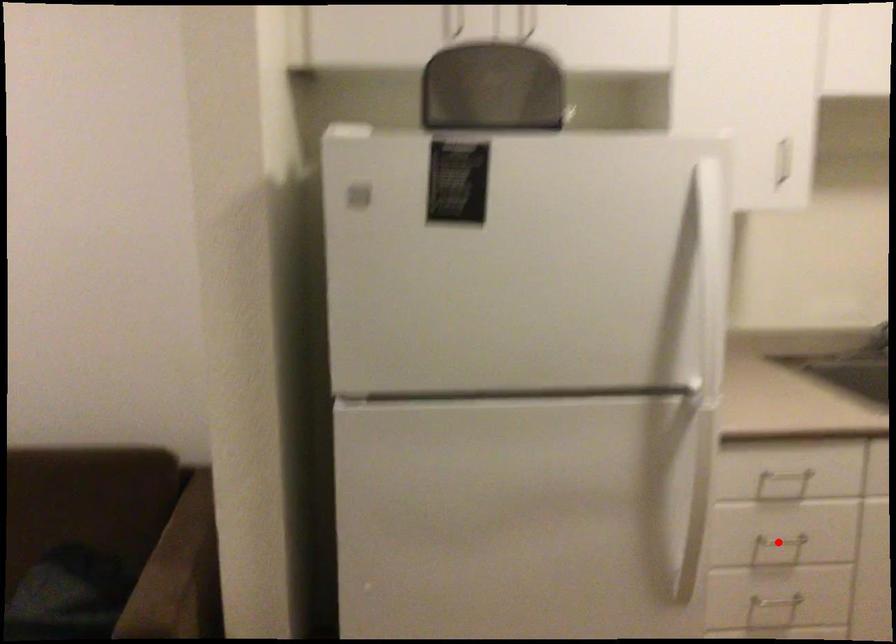
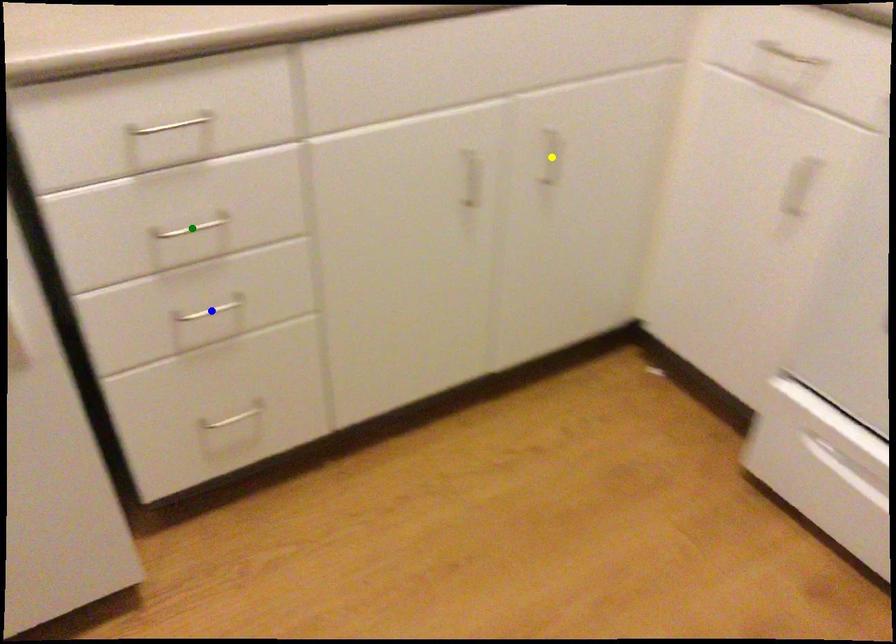
Question: I am providing you with two images of the same scene from different viewpoints. A red point is marked on the first image. You are given multiple points on the second image. Which mark in image 2 goes with the point in image 1?

Choices:
 (A) blue point
 (B) green point
 (C) yellow point

Answer: (B)